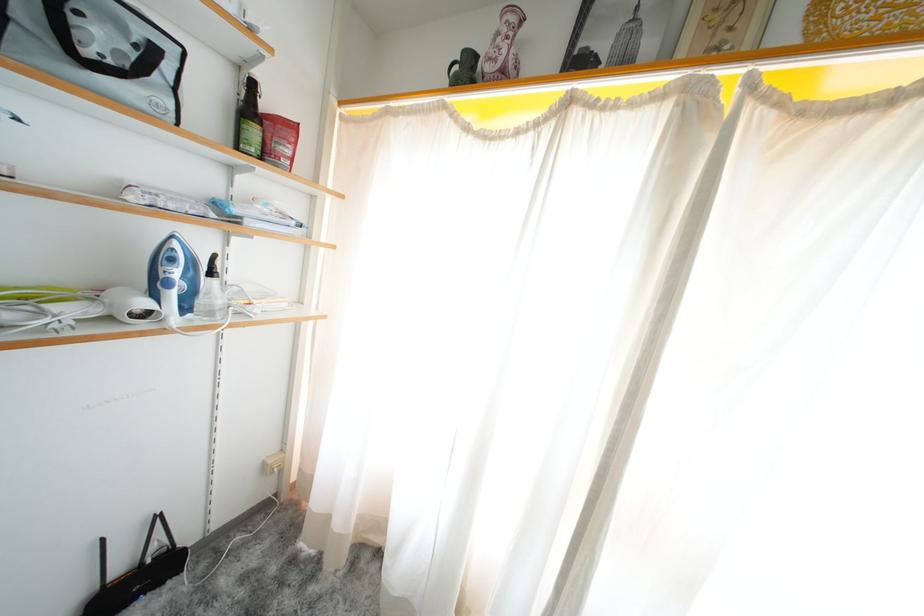
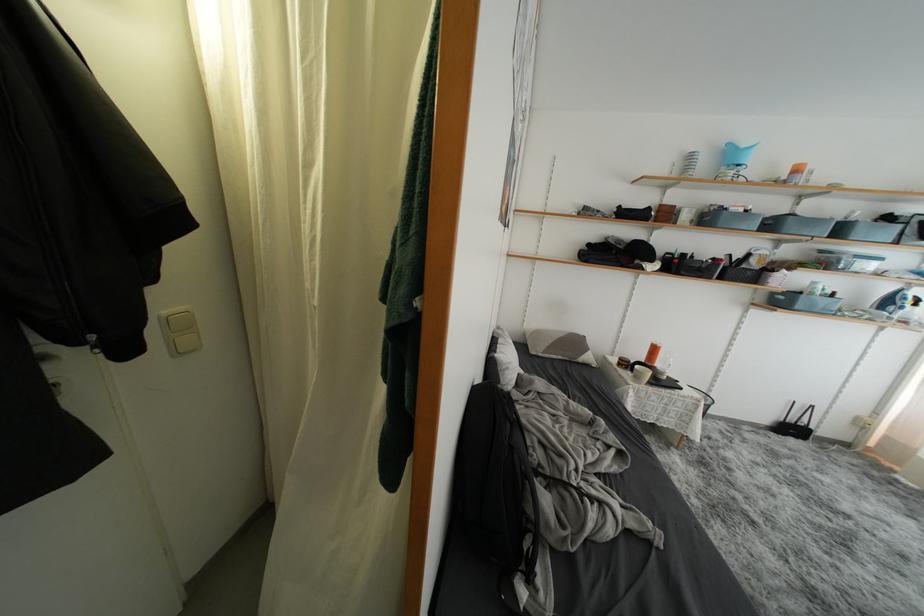
Locate, in the second image, the point that corresponds to the point at 143,586 in the first image.

(797, 434)